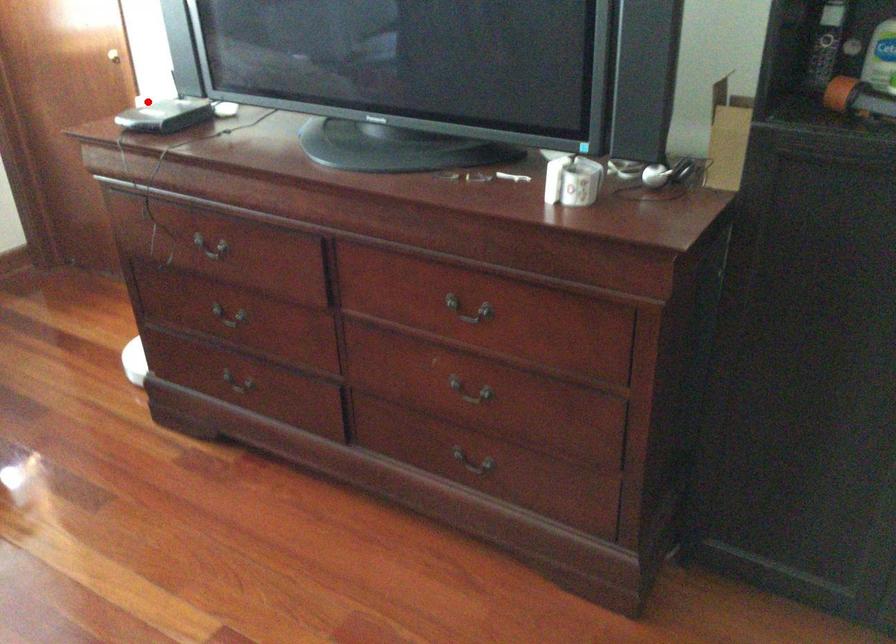
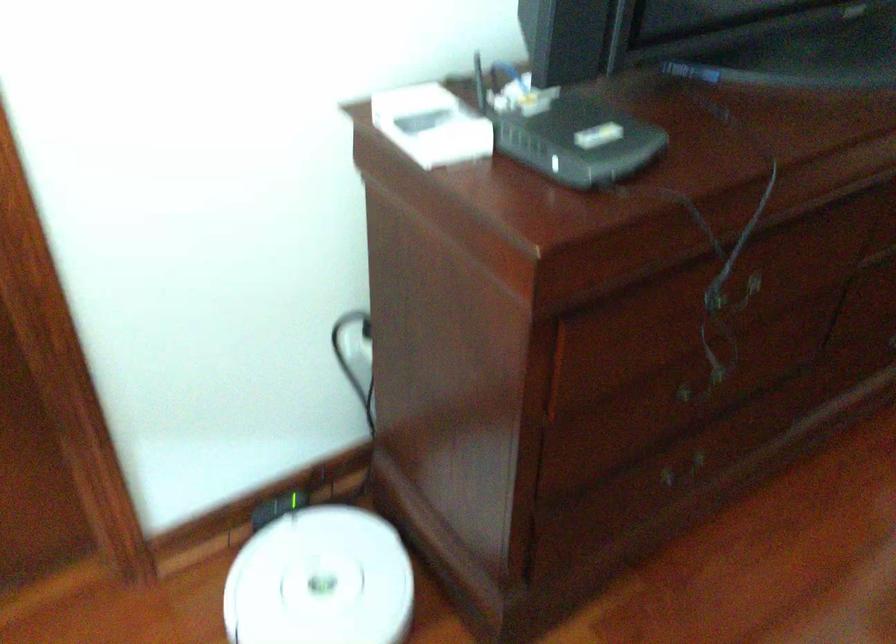
In the second image, find the point that corresponds to the highlighted location in the first image.

(431, 125)